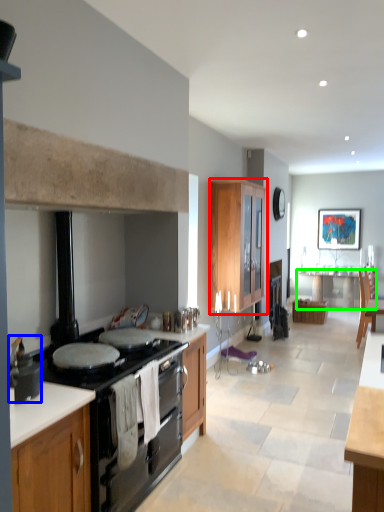
Question: Estimate the real-world distances between objects in this image. Which object is farther from cabinetry (highlighted by a red box), pot/pan (highlighted by a blue box) or table (highlighted by a green box)?

Choices:
 (A) pot/pan
 (B) table

Answer: (A)